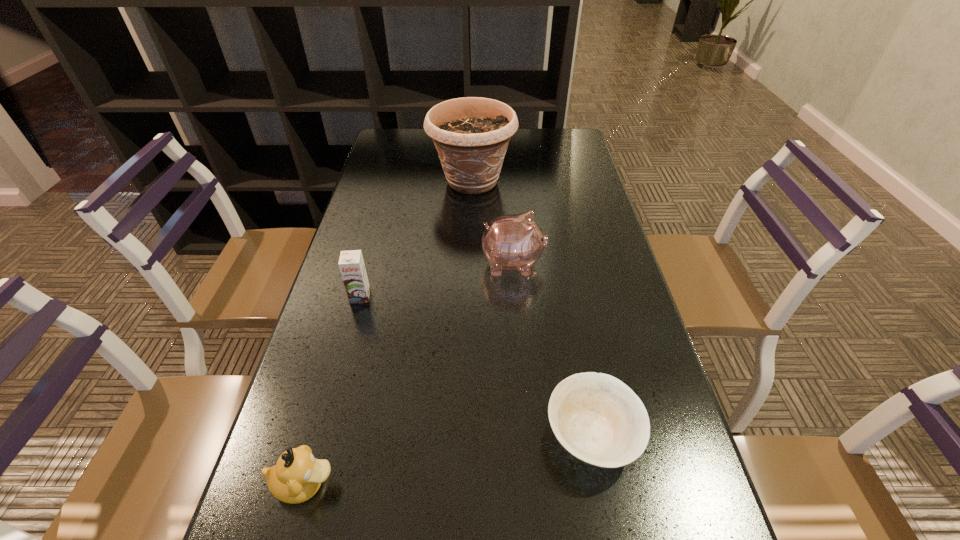
Locate an element on the screen. This screenshot has height=540, width=960. free spot between the fourth tallest object and the third nearest object is located at coordinates (332, 390).

Find the location of a particular element. The width and height of the screenshot is (960, 540). blank region between the third farthest object and the bowl is located at coordinates (476, 366).

Find the location of a particular element. vacant space that is in between the bowl and the third nearest object is located at coordinates (476, 366).

Locate an element on the screen. vacant space that is in between the third nearest object and the fourth nearest object is located at coordinates (437, 280).

Where is `object that can be found as the third closest to the piggy bank`? Image resolution: width=960 pixels, height=540 pixels. object that can be found as the third closest to the piggy bank is located at coordinates (598, 419).

Select which object appears as the closest to the second shortest object. Please provide its 2D coordinates. Your answer should be formatted as a tuple, i.e. [(x, y)], where the tuple contains the x and y coordinates of a point satisfying the conditions above.

[(598, 419)]

Locate an element on the screen. The height and width of the screenshot is (540, 960). vacant space that satisfies the following two spatial constraints: 1. on the front side of the flowerpot; 2. on the front facing side of the fourth nearest object is located at coordinates point(470,264).

The width and height of the screenshot is (960, 540). In order to click on blank space that satisfies the following two spatial constraints: 1. on the front side of the tallest object; 2. on the front facing side of the fourth nearest object in this screenshot , I will do `click(470, 264)`.

Where is `blank space that satisfies the following two spatial constraints: 1. on the front side of the shortest object; 2. on the left side of the farthest object`? This screenshot has height=540, width=960. blank space that satisfies the following two spatial constraints: 1. on the front side of the shortest object; 2. on the left side of the farthest object is located at coordinates (466, 435).